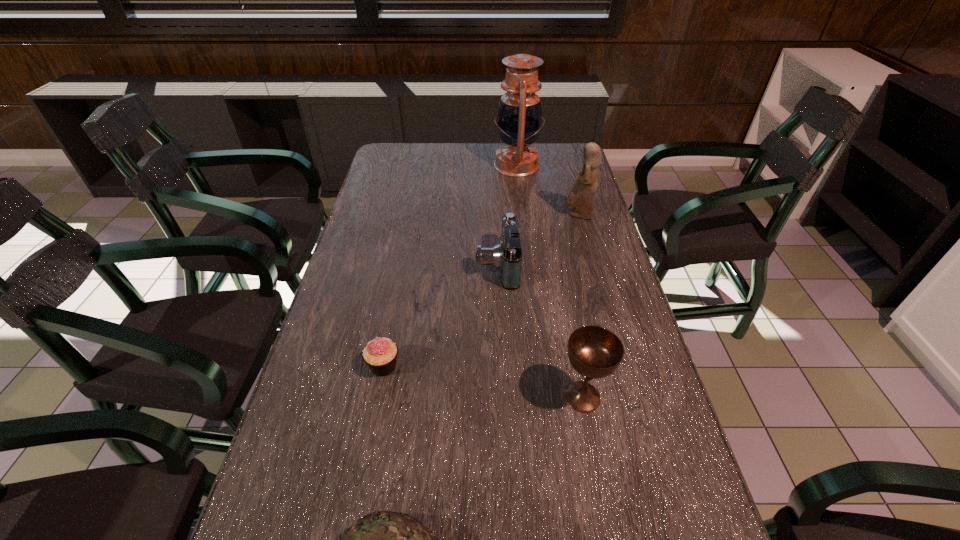
This screenshot has height=540, width=960. Find the location of `chalice that is positioned at the right edge`. chalice that is positioned at the right edge is located at coordinates (595, 352).

Find the location of a particular element. Image resolution: width=960 pixels, height=540 pixels. vacant space at the far edge of the desktop is located at coordinates pos(460,157).

Where is `blank space at the left edge of the desktop`? blank space at the left edge of the desktop is located at coordinates [330, 476].

The width and height of the screenshot is (960, 540). In order to click on free region at the right edge of the desktop in this screenshot , I will do `click(580, 317)`.

The height and width of the screenshot is (540, 960). What are the coordinates of `free space at the far right corner of the desktop` in the screenshot? It's located at (552, 165).

The height and width of the screenshot is (540, 960). Identify the location of blank region between the chalice and the oil lamp. (549, 281).

Find the location of a particular element. The width and height of the screenshot is (960, 540). vacant area that lies between the cupcake and the camcorder is located at coordinates (441, 316).

Locate an element on the screen. free space that is in between the cupcake and the third shortest object is located at coordinates (441, 316).

The width and height of the screenshot is (960, 540). In order to click on free space between the third farthest object and the chalice in this screenshot , I will do `click(540, 331)`.

Image resolution: width=960 pixels, height=540 pixels. Find the location of `free space between the camcorder and the figurine`. free space between the camcorder and the figurine is located at coordinates (538, 240).